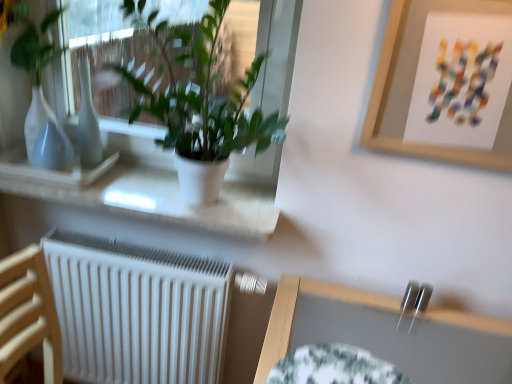
The height and width of the screenshot is (384, 512). Find the location of `empty space that is ontop of white matte window sill at upper left`. empty space that is ontop of white matte window sill at upper left is located at coordinates (139, 183).